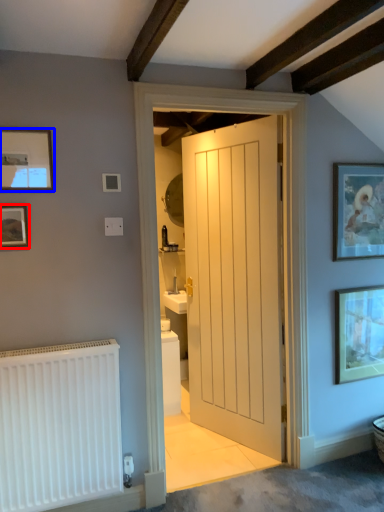
Question: Which object appears closest to the camera in this image, picture frame (highlighted by a red box) or picture frame (highlighted by a blue box)?

Choices:
 (A) picture frame
 (B) picture frame

Answer: (B)